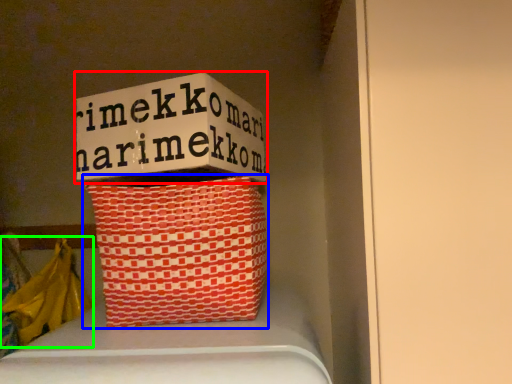
Question: Estimate the real-world distances between objects in this image. Which object is farther from box (highlighted by a red box), basket (highlighted by a blue box) or material (highlighted by a green box)?

Choices:
 (A) basket
 (B) material

Answer: (B)